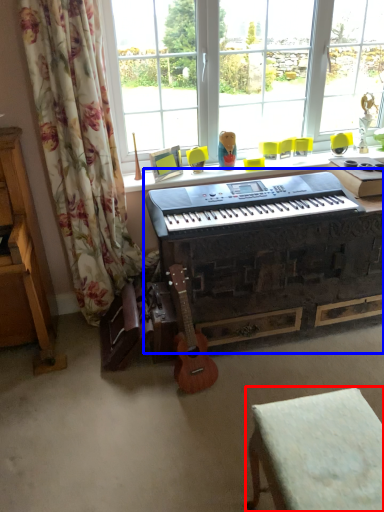
Question: Which object is closer to the camera taking this photo, furniture (highlighted by a red box) or piano (highlighted by a blue box)?

Choices:
 (A) furniture
 (B) piano

Answer: (A)